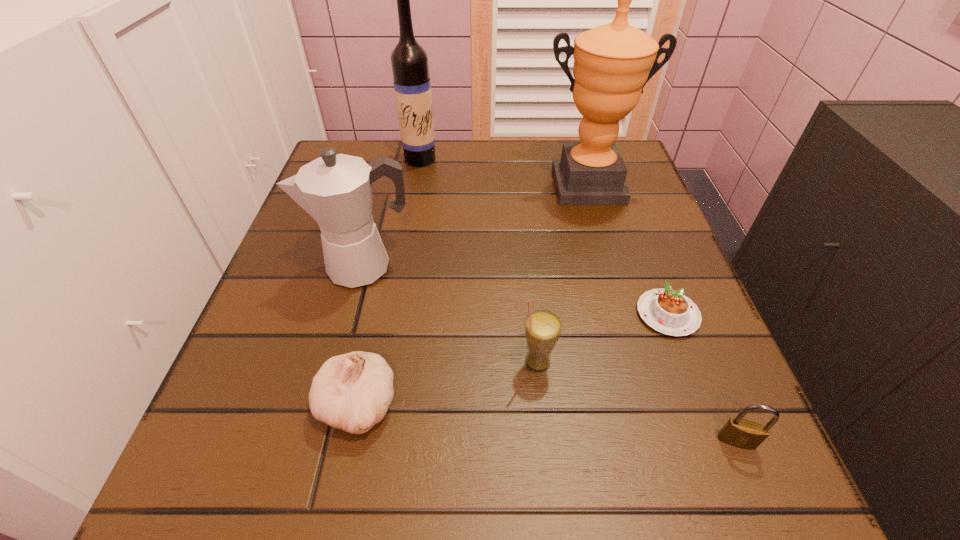
The height and width of the screenshot is (540, 960). Find the location of `object identified as the fourth closest to the second shortest object`. object identified as the fourth closest to the second shortest object is located at coordinates (612, 63).

Locate an element on the screen. The width and height of the screenshot is (960, 540). the fifth closest object relative to the shortest object is located at coordinates (336, 190).

This screenshot has height=540, width=960. I want to click on vacant point that satisfies the following two spatial constraints: 1. on the label of the wine bottle; 2. on the left side of the fourth nearest object, so click(x=394, y=314).

The image size is (960, 540). What are the coordinates of `blank area in the image that satisfies the following two spatial constraints: 1. on the label of the sixth tallest object; 2. on the right side of the wine bottle` in the screenshot? It's located at (371, 441).

This screenshot has width=960, height=540. What are the coordinates of `free point that satisfies the following two spatial constraints: 1. on the back side of the straw for drinking; 2. on the left side of the fourth farthest object` in the screenshot? It's located at (532, 314).

This screenshot has height=540, width=960. In order to click on free point that satisfies the following two spatial constraints: 1. on the front side of the fourth farthest object; 2. on the right side of the coffeepot in this screenshot , I will do `click(352, 314)`.